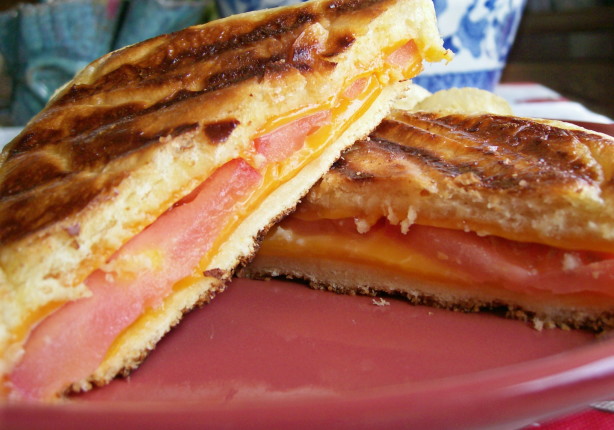
Identify the location of red and white tablecloth. (550, 105), (592, 423).